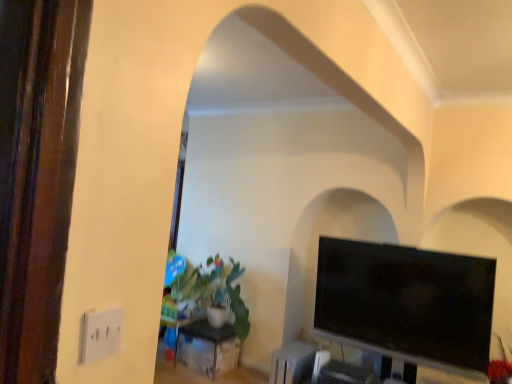
Question: Can you confirm if green matte plant at center-left is taller than black metal table at center?

Choices:
 (A) no
 (B) yes

Answer: (B)

Question: From the image's perspective, would you say green matte plant at center-left is shown under black metal table at center?

Choices:
 (A) yes
 (B) no

Answer: (B)

Question: Is green matte plant at center-left to the left of black metal table at center from the viewer's perspective?

Choices:
 (A) no
 (B) yes

Answer: (A)

Question: From a real-world perspective, is green matte plant at center-left located higher than black metal table at center?

Choices:
 (A) yes
 (B) no

Answer: (A)

Question: From a real-world perspective, is green matte plant at center-left under black metal table at center?

Choices:
 (A) no
 (B) yes

Answer: (A)

Question: Is green matte plant at center-left with black metal table at center?

Choices:
 (A) no
 (B) yes

Answer: (A)

Question: Is black metal table at center not within green matte plant at center-left?

Choices:
 (A) yes
 (B) no

Answer: (A)

Question: From a real-world perspective, is black metal table at center over green matte plant at center-left?

Choices:
 (A) yes
 (B) no

Answer: (B)

Question: Is black metal table at center directly adjacent to green matte plant at center-left?

Choices:
 (A) yes
 (B) no

Answer: (B)

Question: Is black metal table at center oriented towards green matte plant at center-left?

Choices:
 (A) no
 (B) yes

Answer: (A)

Question: From a real-world perspective, does black metal table at center sit lower than green matte plant at center-left?

Choices:
 (A) yes
 (B) no

Answer: (A)

Question: From the image's perspective, is black metal table at center below green matte plant at center-left?

Choices:
 (A) yes
 (B) no

Answer: (A)

Question: Is green matte plant at center-left wider than black glossy tv at right?

Choices:
 (A) yes
 (B) no

Answer: (A)